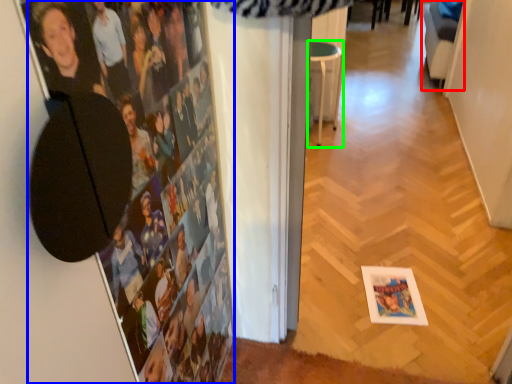
Question: Which object is the closest to the swivel chair (highlighted by a red box)? Choose among these: person (highlighted by a blue box) or furniture (highlighted by a green box).

Choices:
 (A) person
 (B) furniture

Answer: (B)